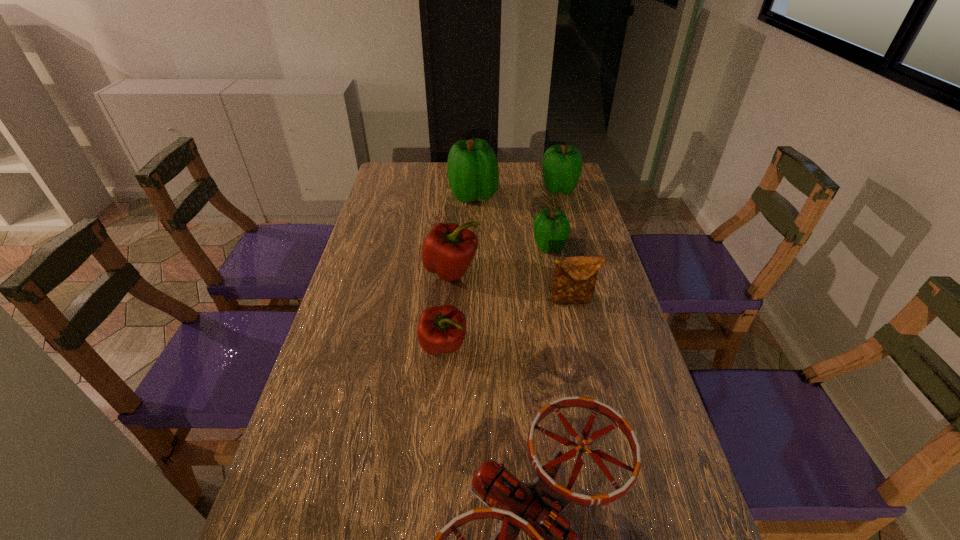
I want to click on vacant area between the second nearest object and the clutch bag, so click(509, 323).

You are a GUI agent. You are given a task and a screenshot of the screen. Output one action in this format:
    pyautogui.click(x=<x>, y=<y>)
    Task: Click on the free area in between the nearer pink bell pepper and the second smallest green bell pepper
    Image resolution: width=960 pixels, height=540 pixels.
    Given the screenshot: What is the action you would take?
    pyautogui.click(x=501, y=267)

Identify the location of empty location between the nearest green bell pepper and the nearest bell pepper. (496, 296).

Where is `free space that is in between the clutch bag and the second smallest green bell pepper`? This screenshot has width=960, height=540. free space that is in between the clutch bag and the second smallest green bell pepper is located at coordinates (566, 245).

This screenshot has width=960, height=540. In order to click on vacant space in between the nearer pink bell pepper and the smallest green bell pepper in this screenshot , I will do `click(496, 296)`.

The width and height of the screenshot is (960, 540). I want to click on free space that is in between the nearest green bell pepper and the farther pink bell pepper, so coord(500,258).

Where is `vacant space that is in between the second biggest green bell pepper and the smaller pink bell pepper`? Image resolution: width=960 pixels, height=540 pixels. vacant space that is in between the second biggest green bell pepper and the smaller pink bell pepper is located at coordinates (501, 267).

Locate an element on the screen. object that ranks as the fourth closest to the second biggest green bell pepper is located at coordinates (574, 279).

You are a GUI agent. You are given a task and a screenshot of the screen. Output one action in this format:
    pyautogui.click(x=<x>, y=<y>)
    Task: Click on the sixth closest object to the biggest green bell pepper
    This screenshot has height=540, width=960.
    Given the screenshot: What is the action you would take?
    pyautogui.click(x=534, y=507)

The image size is (960, 540). Find the location of `the fifth closest bell pepper to the red drone`. the fifth closest bell pepper to the red drone is located at coordinates (562, 165).